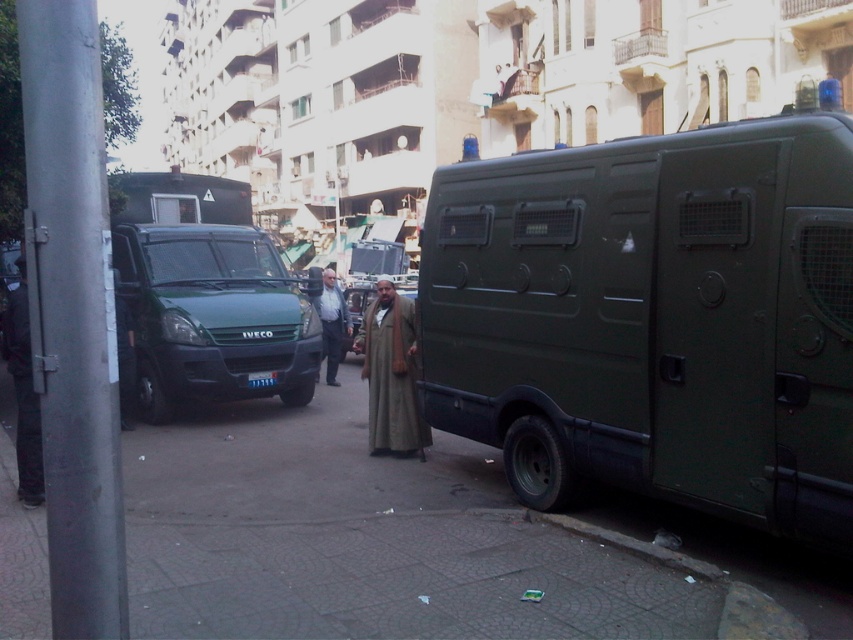
You are a delivery driver who needs to back out of a parking spot between the matte green van at right and the green matte van at center. Which van should you avoid hitting by keeping your distance?

You should keep your distance from the matte green van at right because it is in front of the green matte van at center, meaning it is closer to you and poses a higher risk of collision when backing out.

You are a delivery driver who needs to park your truck between the two vans. The matte green van at right and the green matte van at center are in your way. Which van should you move first to create space?

The matte green van at right is below the green matte van at center, so you should move the green matte van at center first to create space.

You are a delivery driver who needs to park your truck between the matte green van at right and the green matte van at center. Based on their widths, which side should you park closer to ensure your truck fits?

The matte green van at right is thinner than the green matte van at center, so you should park closer to the matte green van at right to ensure your truck fits between them.